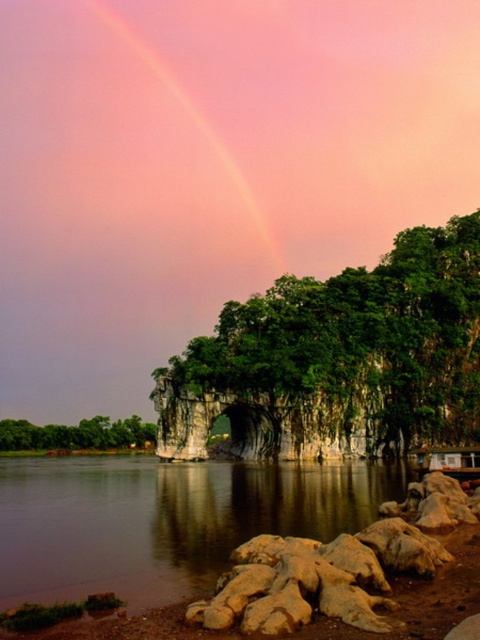
You are standing at the shoreline looking at the scene. Which object is positioned to the right of the other between the pink translucent rainbow at upper center and the green leafy tree at lower left?

The pink translucent rainbow at upper center is positioned to the right of the green leafy tree at lower left.